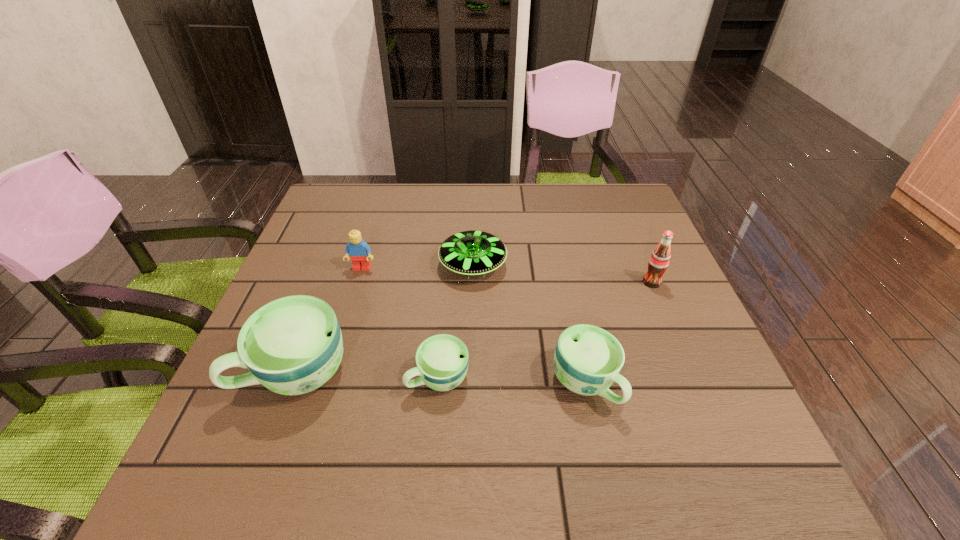
Considering the uniform spacing of cups, where should an additional cup be positioned on the right? Please locate a free spot. Please provide its 2D coordinates. Your answer should be formatted as a tuple, i.e. [(x, y)], where the tuple contains the x and y coordinates of a point satisfying the conditions above.

[(733, 390)]